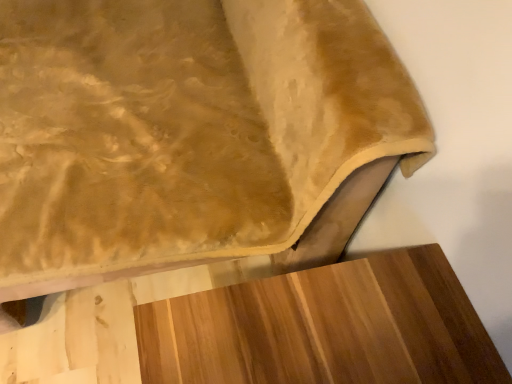
I want to click on velvet gold blanket at upper left, so click(x=185, y=130).

Measure the distance between velvet gold blanket at upper left and camera.

velvet gold blanket at upper left is 26.55 inches away from camera.

The width and height of the screenshot is (512, 384). Describe the element at coordinates (185, 130) in the screenshot. I see `velvet gold blanket at upper left` at that location.

Identify the location of velvet gold blanket at upper left. (185, 130).